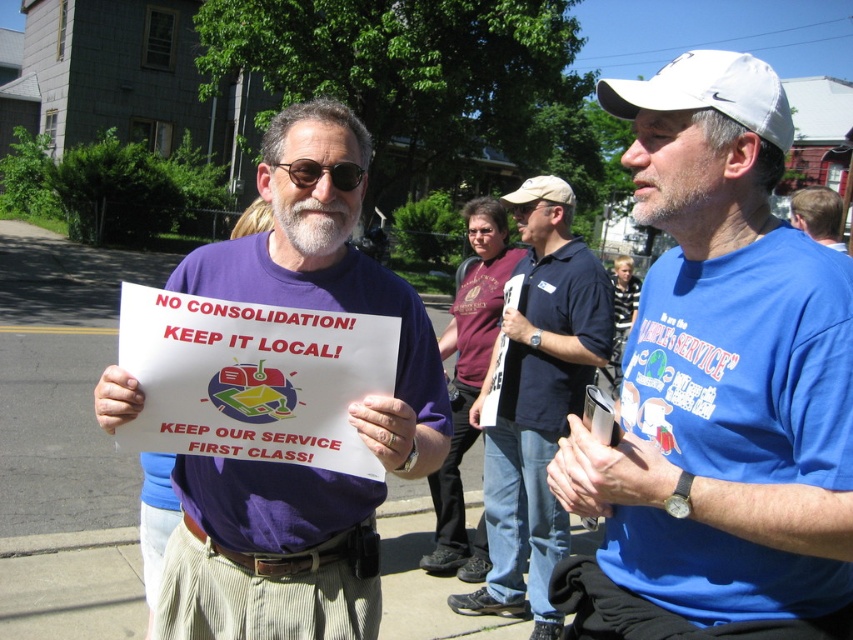
Which is more to the left, white fabric baseball cap at upper right or black plastic sunglasses at center?

black plastic sunglasses at center is more to the left.

Can you confirm if white fabric baseball cap at upper right is positioned below black plastic sunglasses at center?

No, white fabric baseball cap at upper right is not below black plastic sunglasses at center.

At what (x,y) coordinates should I click in order to perform the action: click on white fabric baseball cap at upper right. Please return your answer as a coordinate pair (x, y). Looking at the image, I should click on (708, 92).

Identify the location of white fabric baseball cap at upper right. Image resolution: width=853 pixels, height=640 pixels. tap(708, 92).

Which of these two, purple fabric shirt at center or white fabric baseball cap at upper right, stands taller?

With more height is purple fabric shirt at center.

Between point (370, 634) and point (691, 68), which one is positioned behind?

Point (370, 634)

Is point (355, 540) positioned in front of point (737, 120)?

No, (355, 540) is behind (737, 120).

Locate an element on the screen. purple fabric shirt at center is located at coordinates (270, 554).

How much distance is there between blue cotton t-shirt at center and graywoollybeard at center?

blue cotton t-shirt at center is 25.14 inches away from graywoollybeard at center.

Consider the image. Which is more to the left, blue cotton t-shirt at center or graywoollybeard at center?

Positioned to the left is graywoollybeard at center.

Who is more distant from viewer, (741, 579) or (355, 211)?

The point (355, 211) is more distant.

What are the coordinates of `blue cotton t-shirt at center` in the screenshot? It's located at (718, 387).